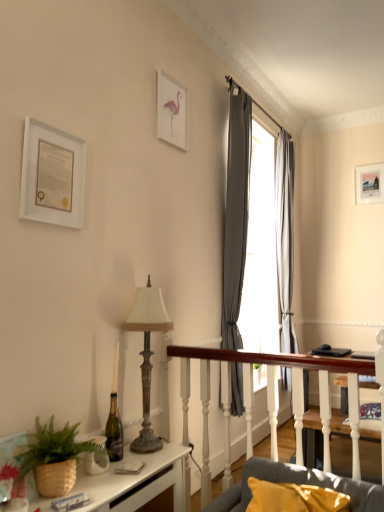
Question: Does point (284, 131) appear closer or farther from the camera than point (211, 510)?

Choices:
 (A) closer
 (B) farther

Answer: (B)

Question: In the image, is gray fabric curtain at upper right, placed as the 1th curtain when sorted from back to front, positioned in front of or behind gray fabric couch at lower right?

Choices:
 (A) front
 (B) behind

Answer: (B)

Question: Based on their relative distances, which object is nearer to the brown woven basket at lower left?

Choices:
 (A) matte white picture frame at upper right, arranged as the first picture frame when viewed from the back
 (B) gray fabric curtain at upper right, the first curtain positioned from the left
 (C) gray fabric curtain at upper right, which is the 2th curtain in front-to-back order
 (D) gray fabric couch at lower right
 (E) wooden table at center

Answer: (D)

Question: Based on their relative distances, which object is farther from the matte white picture frame at upper right, the third picture frame when ordered from left to right?

Choices:
 (A) wooden table at center
 (B) gray fabric couch at lower right
 (C) gray fabric curtain at upper right, placed as the 1th curtain when sorted from back to front
 (D) white matte picture frame at upper left, the 1th picture frame positioned from the front
 (E) antique brass lamp at center-left

Answer: (D)